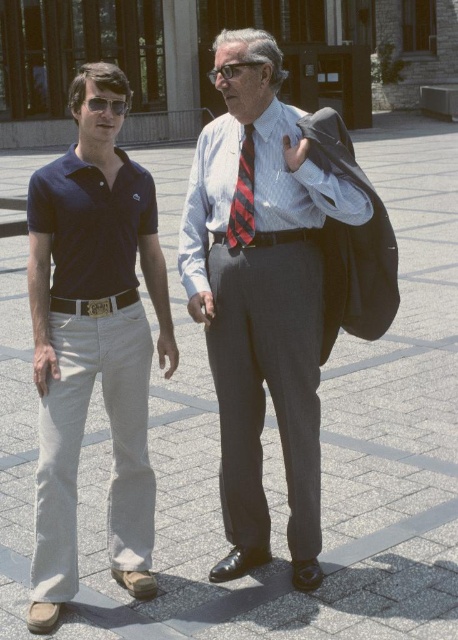
Question: Considering the relative positions of red striped tie at center and matte black sunglasses at left in the image provided, where is red striped tie at center located with respect to matte black sunglasses at left?

Choices:
 (A) left
 (B) right

Answer: (B)

Question: Estimate the real-world distances between objects in this image. Which object is closer to the matte blue polo shirt at left?

Choices:
 (A) navy cotton polo at left
 (B) matte black sunglasses at left

Answer: (A)

Question: Among these objects, which one is nearest to the camera?

Choices:
 (A) clear plastic glasses at center
 (B) navy cotton polo at left

Answer: (B)

Question: Is matte gray suit at center smaller than black leather belt at center?

Choices:
 (A) yes
 (B) no

Answer: (B)

Question: Which point appears closest to the camera in this image?

Choices:
 (A) (223, 65)
 (B) (93, 310)

Answer: (A)

Question: From the image, what is the correct spatial relationship of black leather belt at center in relation to clear plastic glasses at center?

Choices:
 (A) below
 (B) above

Answer: (A)